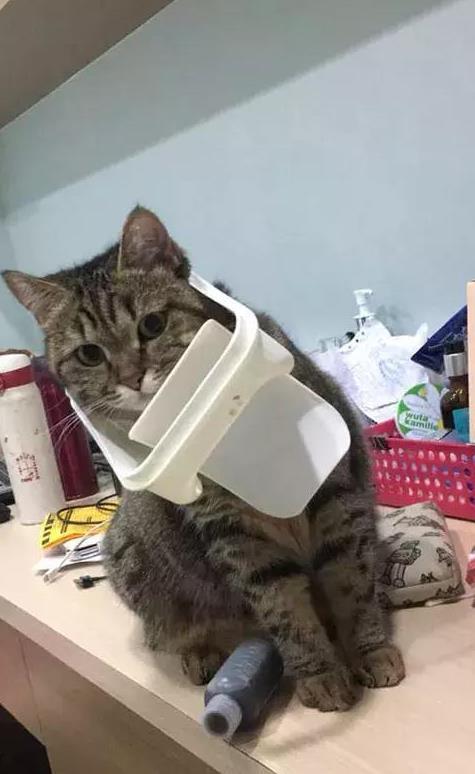
The height and width of the screenshot is (774, 475). I want to click on wall behind cat, so click(x=332, y=170).